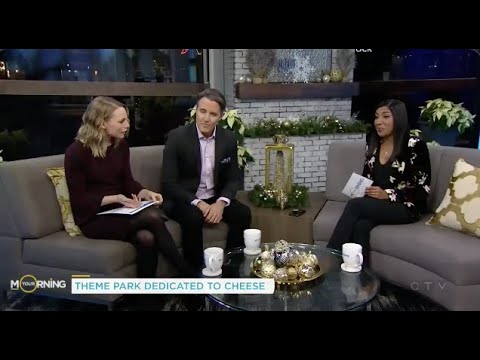
Locate an element on the screen. The width and height of the screenshot is (480, 360). brick wall is located at coordinates (311, 161).